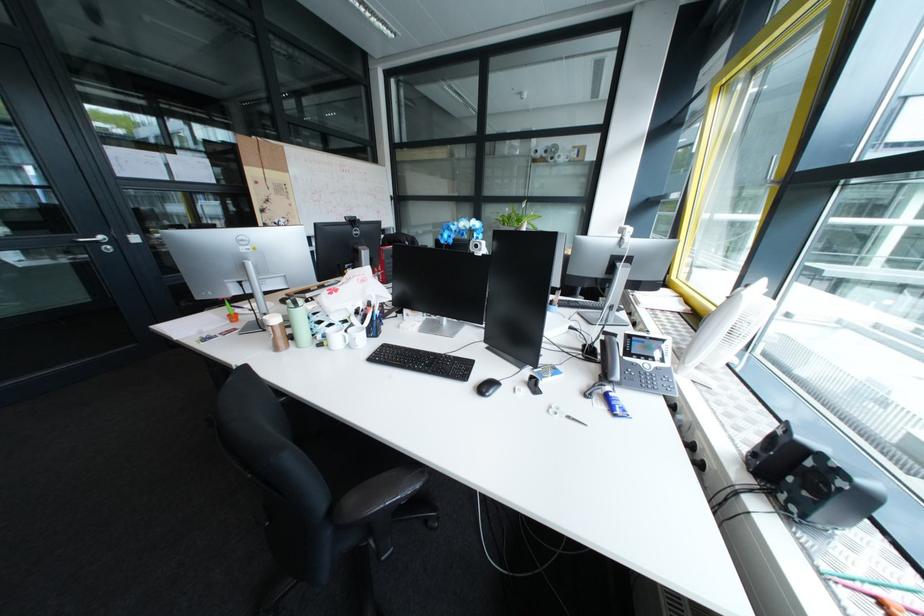
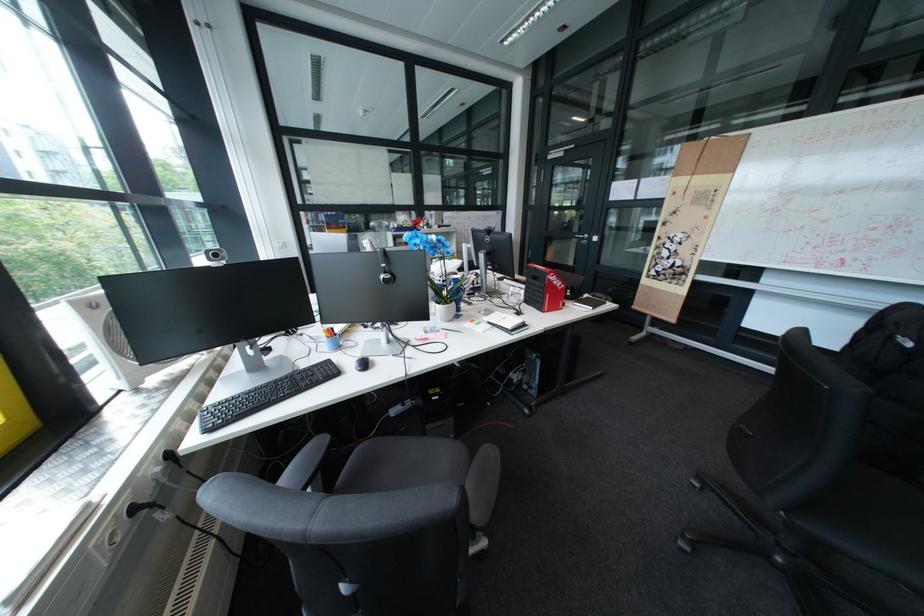
Question: I am providing you with two images of the same scene from different viewpoints. Which of the following objects are not visible in image2?

Choices:
 (A) small black notebook
 (B) phone handset
 (C) grey chair armrest
 (D) silver tissue box

Answer: (B)